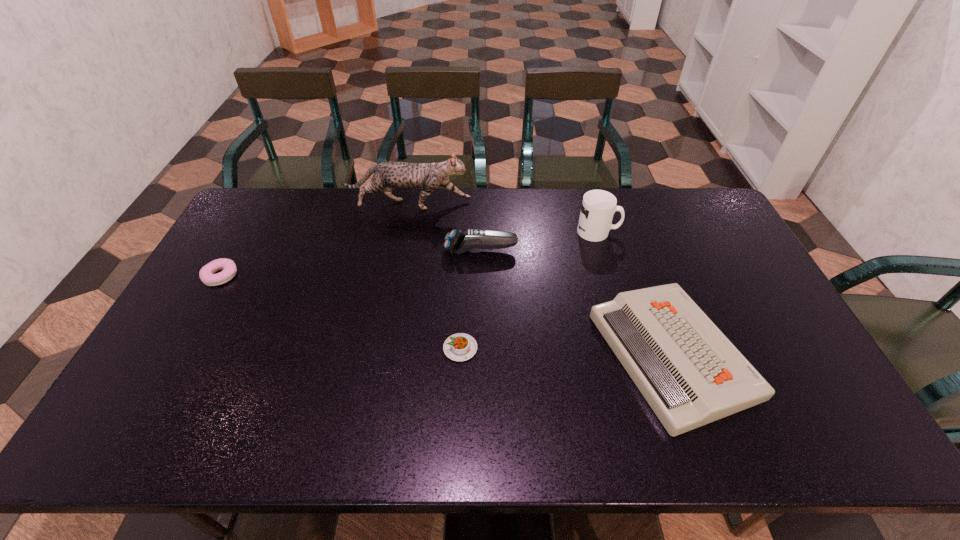
This screenshot has width=960, height=540. Find the location of `object that is at the near edge`. object that is at the near edge is located at coordinates (688, 371).

Image resolution: width=960 pixels, height=540 pixels. I want to click on object that is at the left edge, so click(x=206, y=274).

Where is `object present at the right edge`? object present at the right edge is located at coordinates (688, 371).

This screenshot has width=960, height=540. In order to click on object at the near right corner in this screenshot , I will do `click(688, 371)`.

Find the location of a particular element. The width and height of the screenshot is (960, 540). blank space at the far edge of the desktop is located at coordinates (574, 195).

You are a GUI agent. You are given a task and a screenshot of the screen. Output one action in this format:
    pyautogui.click(x=<x>, y=<y>)
    Task: Click on the vacant space at the near edge of the desktop
    This screenshot has height=540, width=960.
    Given the screenshot: What is the action you would take?
    pyautogui.click(x=507, y=414)

In the image, there is a desktop. Where is `free space at the left edge`? The height and width of the screenshot is (540, 960). free space at the left edge is located at coordinates (201, 280).

Identify the location of blank space at the right edge of the desktop. The height and width of the screenshot is (540, 960). pyautogui.click(x=704, y=245).

You are a GUI agent. You are given a task and a screenshot of the screen. Output one action in this format:
    pyautogui.click(x=<x>, y=<y>)
    Task: Click on the free region at the far left corner of the desktop
    Image resolution: width=960 pixels, height=540 pixels.
    Given the screenshot: What is the action you would take?
    pyautogui.click(x=256, y=204)

This screenshot has width=960, height=540. I want to click on vacant space at the near left corner of the desktop, so click(156, 444).